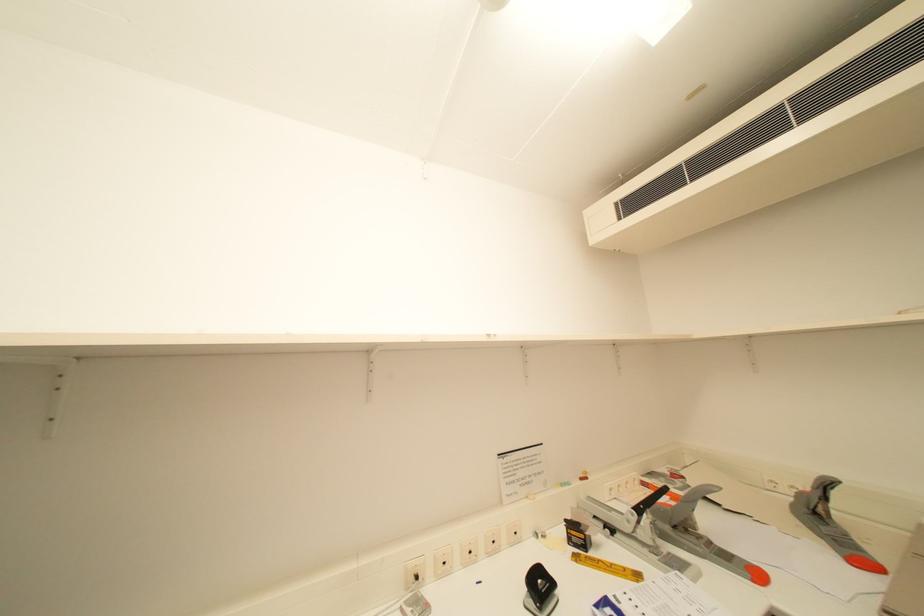
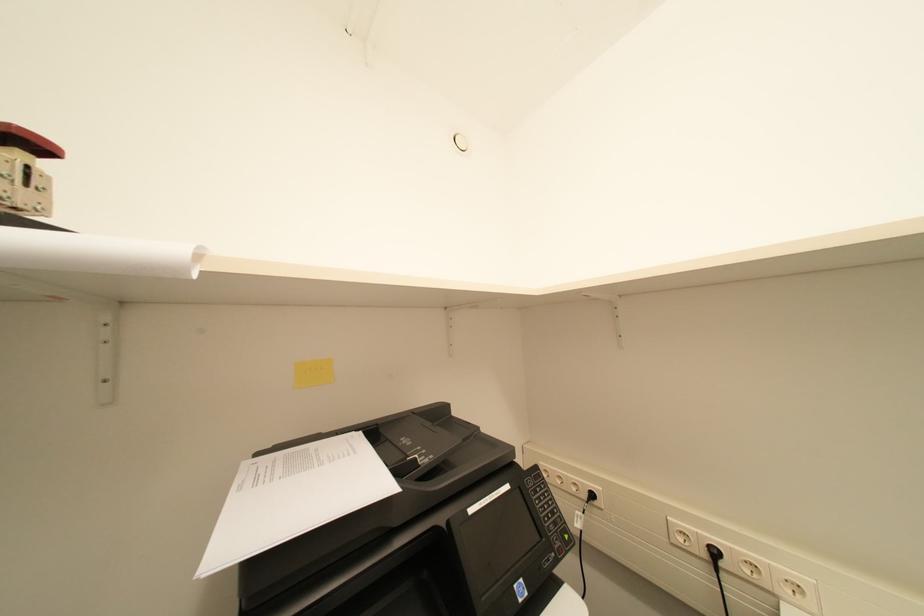
Question: The first image is from the beginning of the video and the second image is from the end. How did the camera likely rotate when shooting the video?

Choices:
 (A) Left
 (B) Right
 (C) Up
 (D) Down

Answer: (A)